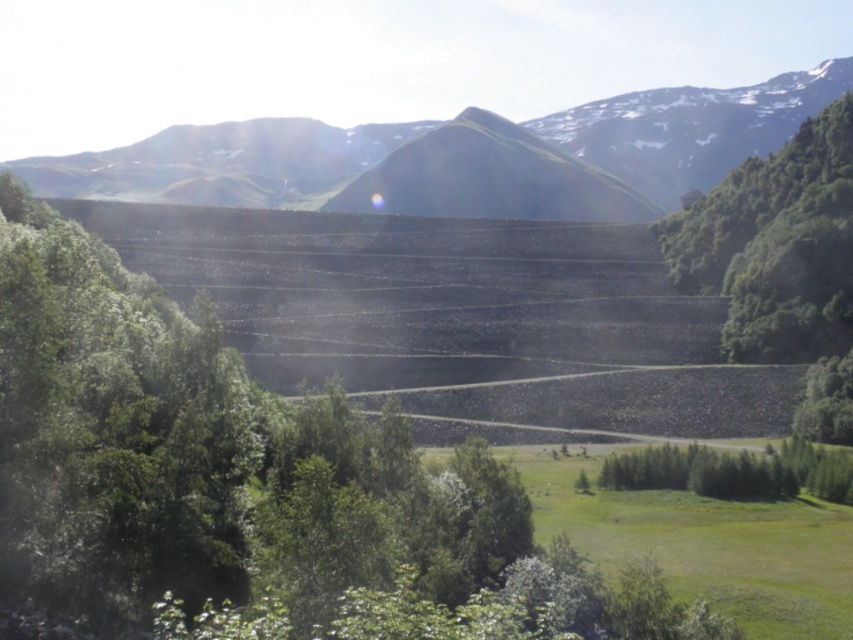
You are a geologist standing at the edge of an open pit mine. You see the green grassy mountain at center in the distance. If your GPS says you are exactly 333.81 meters away from it, does that mean you are at the edge of the mine?

Yes, because the green grassy mountain at center is 333.81 meters away from the camera, which matches your GPS distance, indicating you are at the edge of the mine where the measurement was taken.

You are a geologist observing the open pit mine. You notice the green leafy tree at right and the green grassy hill at center. Which object is closer to you, the observer?

The green leafy tree at right is closer to you because it is positioned in front of the green grassy hill at center.